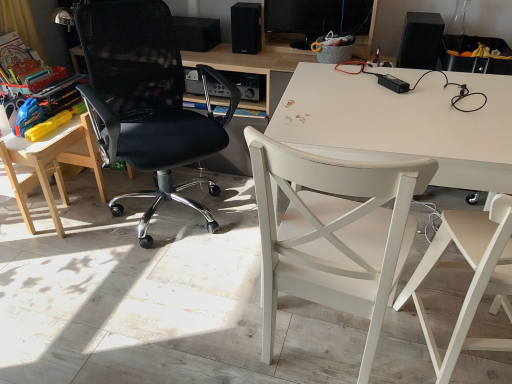
Question: Is black matte speaker at upper center, which appears as the 3th loudspeaker when viewed from the right, at the right side of wooden table at left?

Choices:
 (A) no
 (B) yes

Answer: (B)

Question: Does black matte speaker at upper center, which appears as the 3th loudspeaker when viewed from the right, appear on the left side of wooden table at left?

Choices:
 (A) no
 (B) yes

Answer: (A)

Question: Would you consider black matte speaker at upper center, arranged as the first loudspeaker when viewed from the left, to be distant from wooden table at left?

Choices:
 (A) no
 (B) yes

Answer: (A)

Question: Can you confirm if black matte speaker at upper center, which appears as the 3th loudspeaker when viewed from the right, is smaller than wooden table at left?

Choices:
 (A) no
 (B) yes

Answer: (B)

Question: Is wooden table at left inside black matte speaker at upper center, which appears as the 3th loudspeaker when viewed from the right?

Choices:
 (A) no
 (B) yes

Answer: (A)

Question: Considering the positions of light wood/wooden chair at left, placed as the first chair when sorted from left to right, and black matte speaker at upper center, acting as the second loudspeaker starting from the right, in the image, is light wood/wooden chair at left, placed as the first chair when sorted from left to right, wider or thinner than black matte speaker at upper center, acting as the second loudspeaker starting from the right,?

Choices:
 (A) thin
 (B) wide

Answer: (B)

Question: Does point (0, 175) appear closer or farther from the camera than point (240, 6)?

Choices:
 (A) farther
 (B) closer

Answer: (B)

Question: Is light wood/wooden chair at left, placed as the first chair when sorted from left to right, inside the boundaries of black matte speaker at upper center, positioned as the second loudspeaker in left-to-right order, or outside?

Choices:
 (A) outside
 (B) inside

Answer: (A)

Question: From the image's perspective, relative to black matte speaker at upper center, acting as the second loudspeaker starting from the right, is light wood/wooden chair at left, placed as the first chair when sorted from left to right, above or below?

Choices:
 (A) below
 (B) above

Answer: (A)

Question: Is light wood/wooden chair at left, placed as the first chair when sorted from left to right, bigger or smaller than black glossy computer monitor at upper center?

Choices:
 (A) big
 (B) small

Answer: (A)

Question: Considering their positions, is light wood/wooden chair at left, the 4th chair from the right, located in front of or behind black glossy computer monitor at upper center?

Choices:
 (A) front
 (B) behind

Answer: (A)

Question: Would you say light wood/wooden chair at left, placed as the first chair when sorted from left to right, is inside or outside black glossy computer monitor at upper center?

Choices:
 (A) inside
 (B) outside

Answer: (B)

Question: Visually, is light wood/wooden chair at left, the 4th chair from the right, positioned to the left or to the right of black glossy computer monitor at upper center?

Choices:
 (A) left
 (B) right

Answer: (A)

Question: From a real-world perspective, is white wood chair at right, which appears as the first chair when viewed from the right, physically located above or below black mesh office chair at left, the second chair from the left?

Choices:
 (A) above
 (B) below

Answer: (B)

Question: Is white wood chair at right, which appears as the first chair when viewed from the right, inside the boundaries of black mesh office chair at left, positioned as the 3th chair in right-to-left order, or outside?

Choices:
 (A) outside
 (B) inside

Answer: (A)